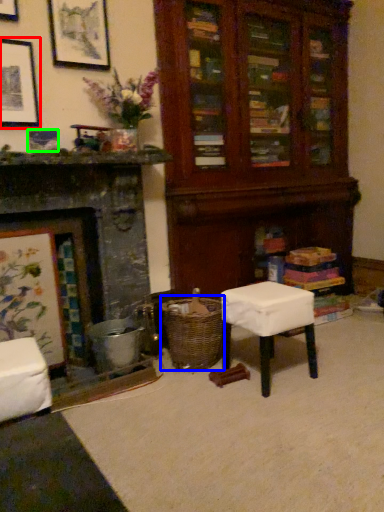
Question: Estimate the real-world distances between objects in this image. Which object is farther from picture frame (highlighted by a red box), crate (highlighted by a blue box) or picture frame (highlighted by a green box)?

Choices:
 (A) crate
 (B) picture frame

Answer: (A)